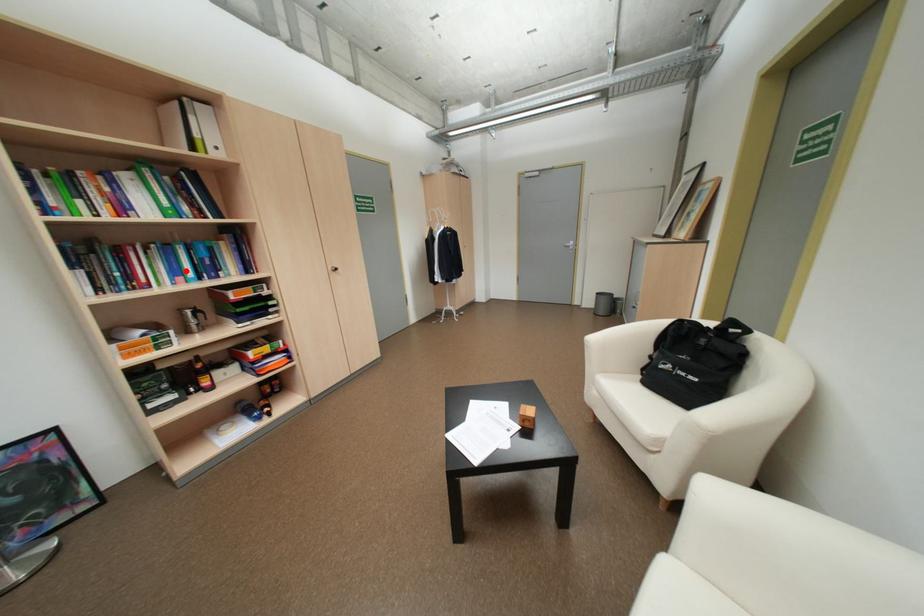
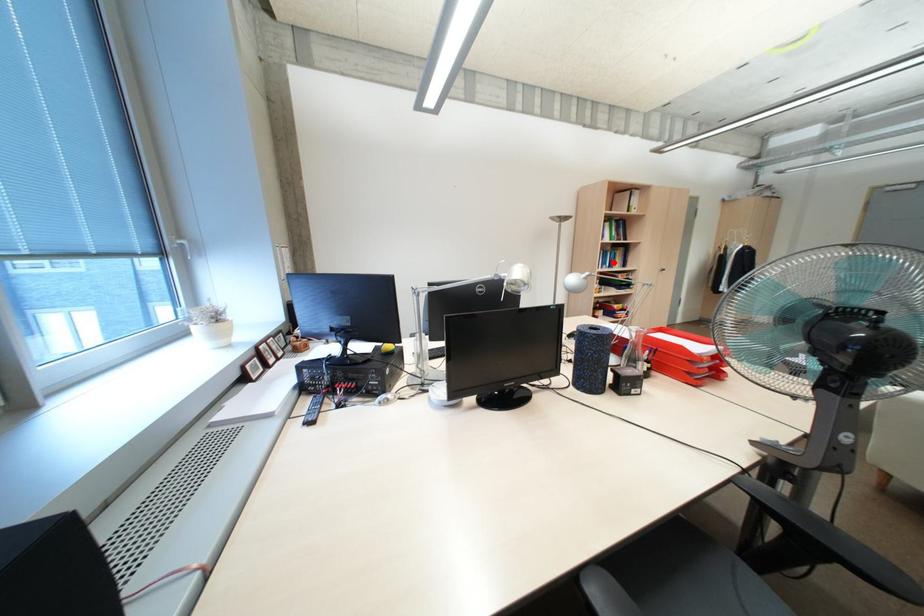
I am providing you with two images of the same scene from different viewpoints. A red point is marked on the first image and another point is marked on the second image. Do the highlighted points in image1 and image2 indicate the same real-world spot?

Yes